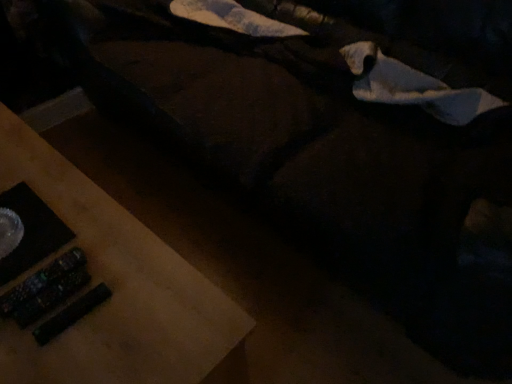
In order to face wooden table at lower left, should I rotate leftwards or rightwards?

Turn left approximately 26.112 degrees to face it.

The width and height of the screenshot is (512, 384). What do you see at coordinates (113, 287) in the screenshot? I see `wooden table at lower left` at bounding box center [113, 287].

I want to click on wooden table at lower left, so click(113, 287).

The image size is (512, 384). Find the location of `wooden table at lower left`. wooden table at lower left is located at coordinates coord(113,287).